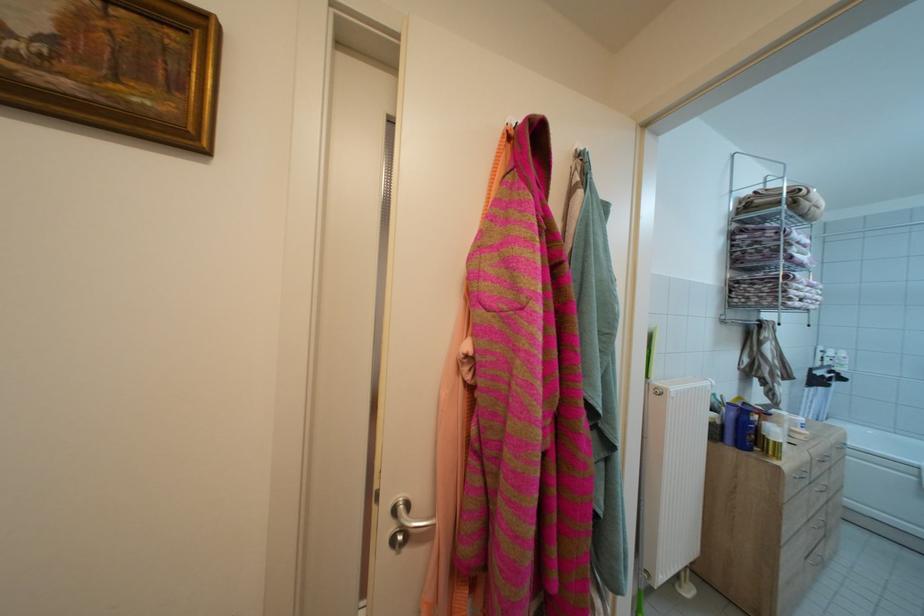
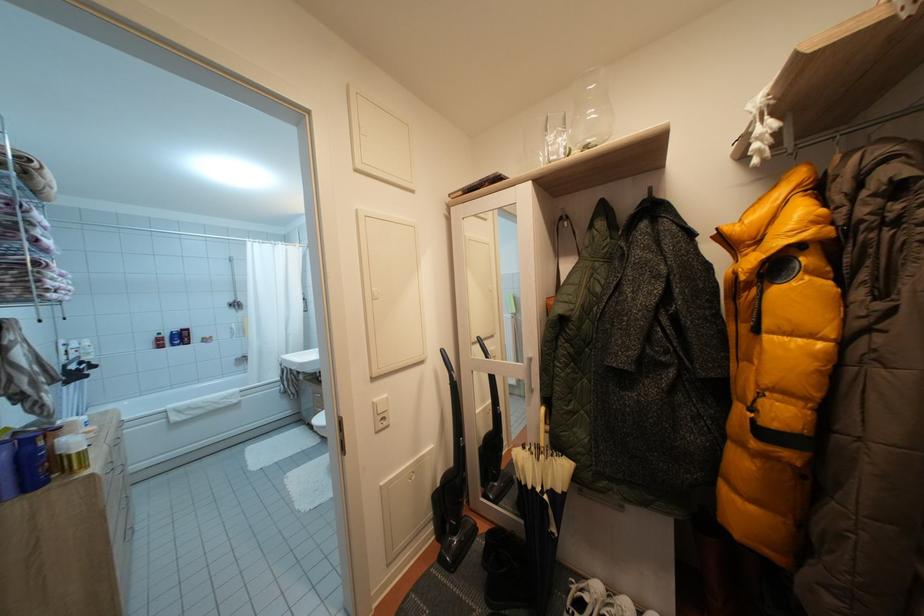
Question: Based on the continuous images, in which direction is the camera rotating? Reply with the corresponding letter.

Choices:
 (A) Left
 (B) Right
 (C) Up
 (D) Down

Answer: (B)